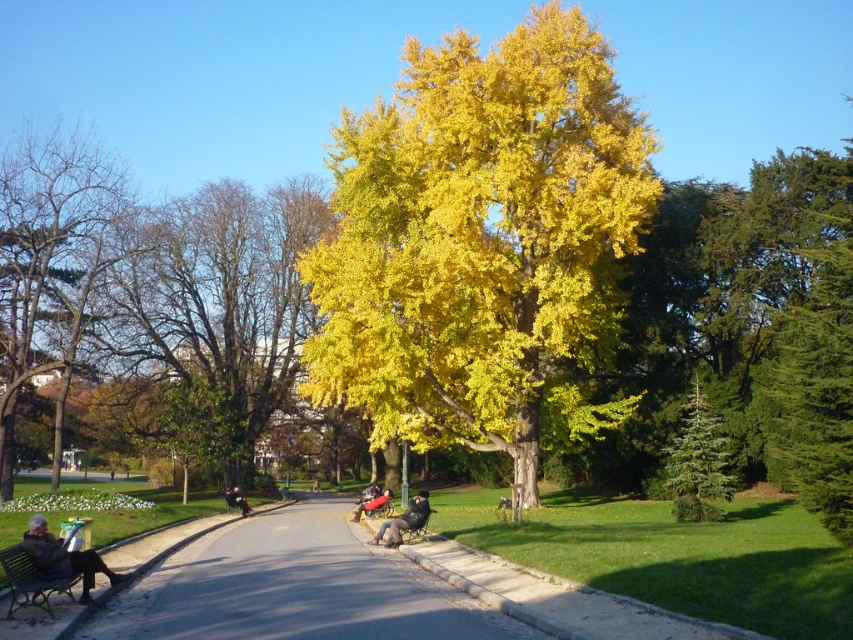
Question: Which point is closer to the camera taking this photo?

Choices:
 (A) (7, 307)
 (B) (39, 560)
 (C) (24, 589)

Answer: (C)

Question: Is the position of smooth asphalt road at center more distant than that of matte black jacket at lower left?

Choices:
 (A) yes
 (B) no

Answer: (B)

Question: Which point is farther to the camera?

Choices:
 (A) matte black jacket at lower left
 (B) leather jacket at center

Answer: (B)

Question: Does yellow/golden leaves at center appear on the right side of dark gray fabric jacket at center?

Choices:
 (A) no
 (B) yes

Answer: (A)

Question: Is bare wood tree at left below green painted wood bench at lower left?

Choices:
 (A) yes
 (B) no

Answer: (B)

Question: Which object appears closest to the camera in this image?

Choices:
 (A) smooth asphalt road at center
 (B) dark brown leather jacket at center
 (C) matte black jacket at lower left

Answer: (A)